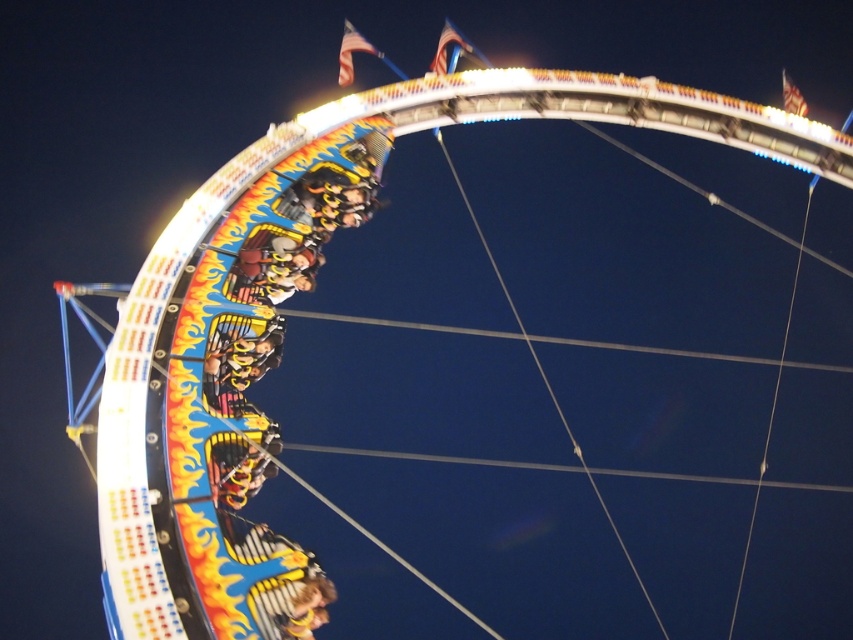
Question: In this image, where is metallic yellow roller coaster car at center located relative to golden textured hair at lower center?

Choices:
 (A) above
 (B) below

Answer: (A)

Question: Which point is closer to the camera?

Choices:
 (A) metallic yellow roller coaster car at center
 (B) golden textured hair at lower center

Answer: (A)

Question: Is metallic yellow roller coaster car at center above golden textured hair at lower center?

Choices:
 (A) yes
 (B) no

Answer: (A)

Question: Can you confirm if metallic yellow roller coaster car at center is smaller than golden textured hair at lower center?

Choices:
 (A) yes
 (B) no

Answer: (B)

Question: Among these points, which one is farthest from the camera?

Choices:
 (A) (310, 568)
 (B) (294, 572)

Answer: (A)